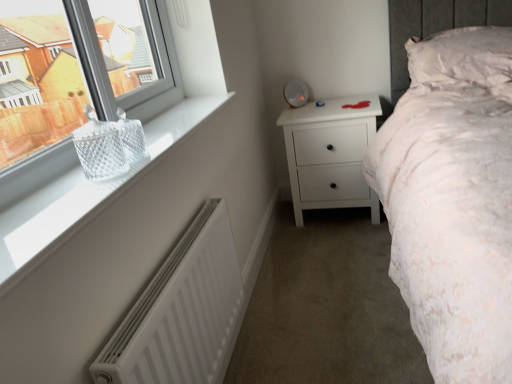
The height and width of the screenshot is (384, 512). I want to click on vacant area on top of clear glass basket at left, which appears as the 1th window when ordered from the bottom (from a real-world perspective), so click(99, 170).